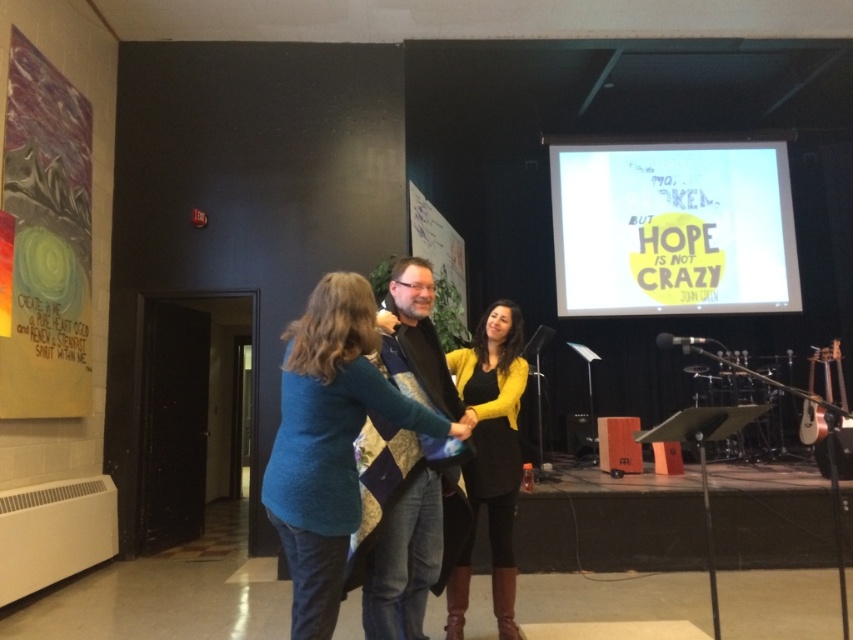
Question: In this image, where is white paper at upper center located relative to yellow knit cardigan at center?

Choices:
 (A) left
 (B) right

Answer: (B)

Question: Which point is farther from the camera taking this photo?

Choices:
 (A) (474, 353)
 (B) (419, 557)
 (C) (757, 298)

Answer: (C)

Question: Is white paper at upper center behind yellow knit cardigan at center?

Choices:
 (A) no
 (B) yes

Answer: (B)

Question: Observing the image, what is the correct spatial positioning of quilted fabric vest at center in reference to yellow knit cardigan at center?

Choices:
 (A) right
 (B) left

Answer: (B)

Question: Which point appears farthest from the camera in this image?

Choices:
 (A) (576, 269)
 (B) (490, 524)
 (C) (416, 320)

Answer: (A)

Question: Which object is the farthest from the yellow knit cardigan at center?

Choices:
 (A) white paper at upper center
 (B) quilted fabric vest at center

Answer: (A)